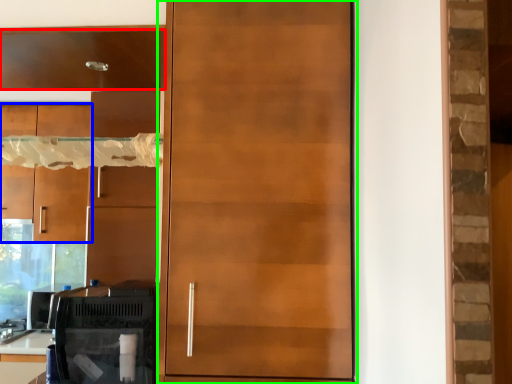
Question: Which object is positioned closest to cabinetry (highlighted by a red box)? Select from cabinetry (highlighted by a blue box) and door (highlighted by a green box).

Choices:
 (A) cabinetry
 (B) door

Answer: (B)